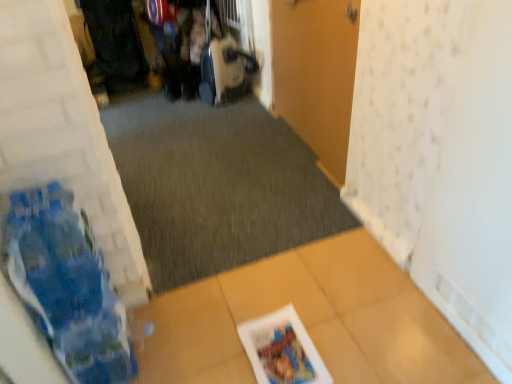
Question: Would you say printed paper magazine at lower center is inside or outside wooden door at center?

Choices:
 (A) inside
 (B) outside

Answer: (B)

Question: From a real-world perspective, relative to wooden door at center, is printed paper magazine at lower center vertically above or below?

Choices:
 (A) above
 (B) below

Answer: (B)

Question: Estimate the real-world distances between objects in this image. Which object is closer to the printed paper magazine at lower center?

Choices:
 (A) dark gray carpet at center
 (B) wooden door at center

Answer: (A)

Question: Estimate the real-world distances between objects in this image. Which object is farther from the wooden door at center?

Choices:
 (A) printed paper magazine at lower center
 (B) dark gray carpet at center

Answer: (A)